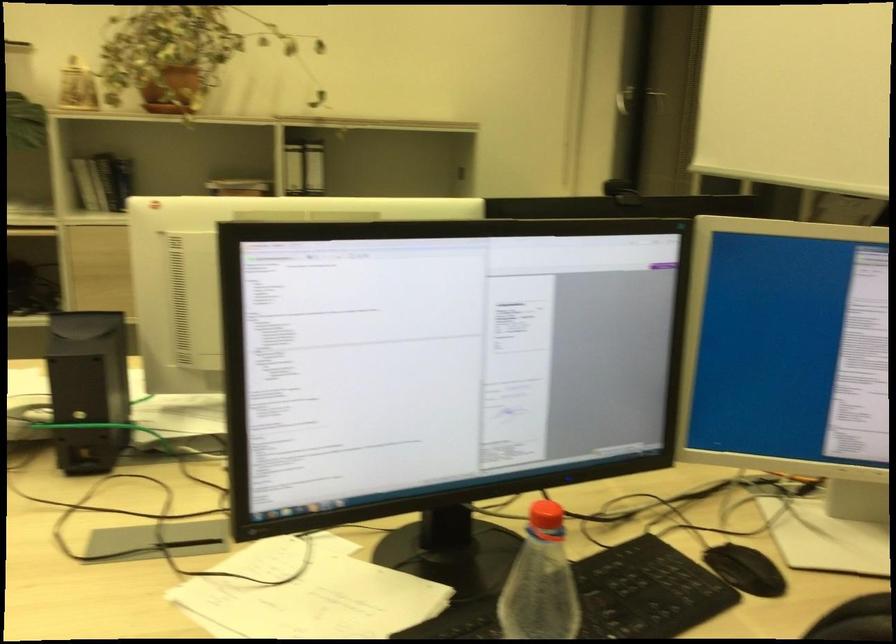
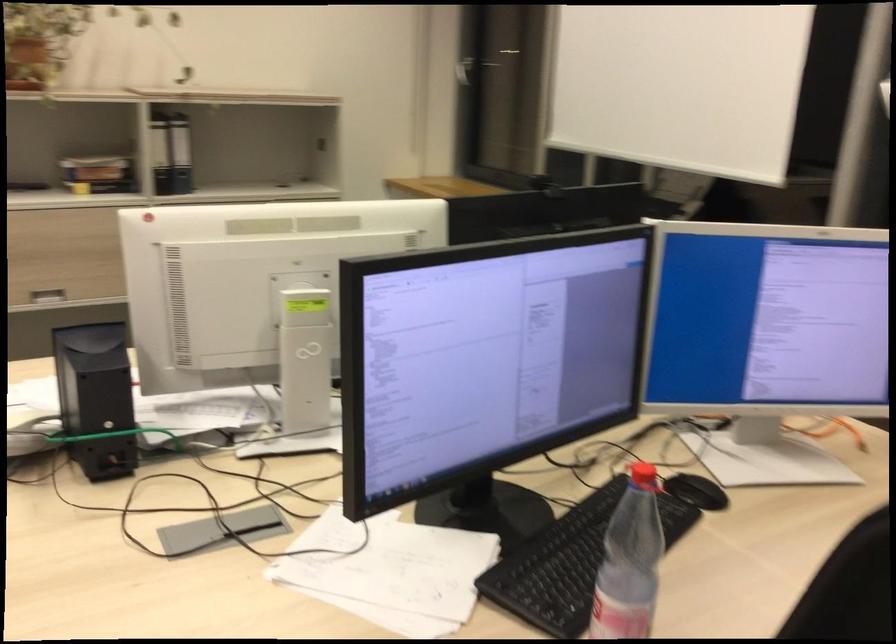
Where in the second image is the point corresponding to [744,571] from the first image?

(695, 491)